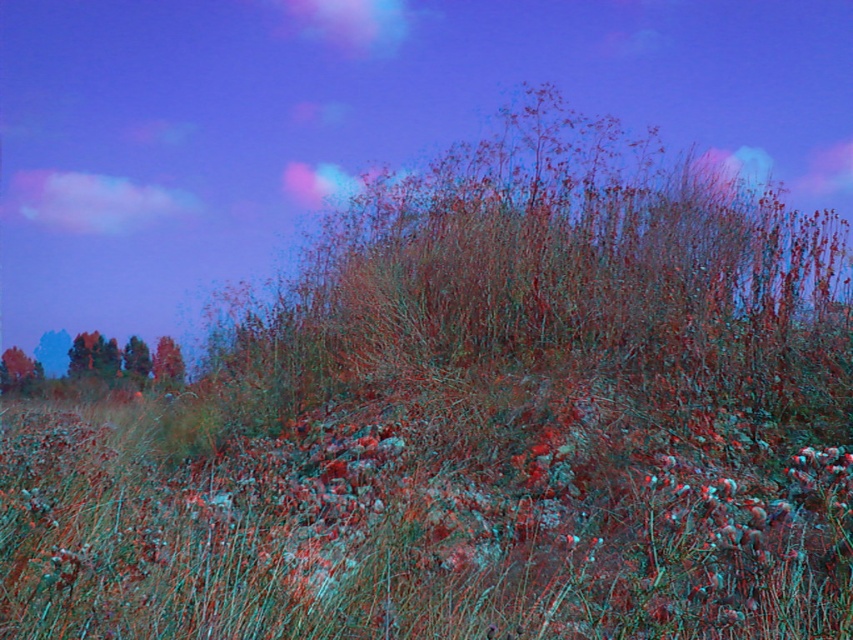
From the picture: Who is more forward, (151, 593) or (154, 378)?

Point (151, 593)

Measure the distance from green grass at center to smooth brown tree at lower left.

They are 11.55 meters apart.

Does point (506, 627) lie in front of point (161, 385)?

Yes, point (506, 627) is closer to viewer.

You are a GUI agent. You are given a task and a screenshot of the screen. Output one action in this format:
    pyautogui.click(x=<x>, y=<y>)
    Task: Click on the green grass at center
    This screenshot has width=853, height=640.
    Given the screenshot: What is the action you would take?
    pyautogui.click(x=418, y=531)